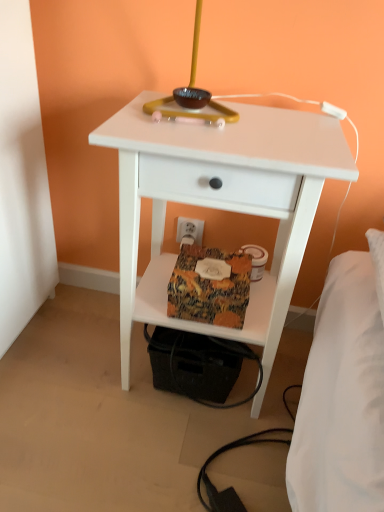
Question: Is matte yellow table lamp at upper center closer to the viewer compared to textured fabric package at lower center?

Choices:
 (A) yes
 (B) no

Answer: (A)

Question: From the image's perspective, does matte yellow table lamp at upper center appear lower than textured fabric package at lower center?

Choices:
 (A) yes
 (B) no

Answer: (B)

Question: Can you confirm if matte yellow table lamp at upper center is positioned to the left of textured fabric package at lower center?

Choices:
 (A) yes
 (B) no

Answer: (A)

Question: Would you say matte yellow table lamp at upper center contains textured fabric package at lower center?

Choices:
 (A) yes
 (B) no

Answer: (B)

Question: Is matte yellow table lamp at upper center far from textured fabric package at lower center?

Choices:
 (A) no
 (B) yes

Answer: (A)

Question: Is matte yellow table lamp at upper center positioned beyond the bounds of textured fabric package at lower center?

Choices:
 (A) no
 (B) yes

Answer: (B)

Question: Can you confirm if white matte nightstand at center is taller than white plastic electric outlet at lower center?

Choices:
 (A) yes
 (B) no

Answer: (A)

Question: From a real-world perspective, is white matte nightstand at center below white plastic electric outlet at lower center?

Choices:
 (A) yes
 (B) no

Answer: (B)

Question: Is white matte nightstand at center not close to white plastic electric outlet at lower center?

Choices:
 (A) yes
 (B) no

Answer: (B)

Question: Is white matte nightstand at center positioned beyond the bounds of white plastic electric outlet at lower center?

Choices:
 (A) no
 (B) yes

Answer: (B)

Question: Does white matte nightstand at center lie in front of white plastic electric outlet at lower center?

Choices:
 (A) yes
 (B) no

Answer: (A)

Question: Is white matte nightstand at center at the right side of white plastic electric outlet at lower center?

Choices:
 (A) no
 (B) yes

Answer: (B)

Question: Is matte yellow table lamp at upper center behind white matte nightstand at center?

Choices:
 (A) no
 (B) yes

Answer: (A)